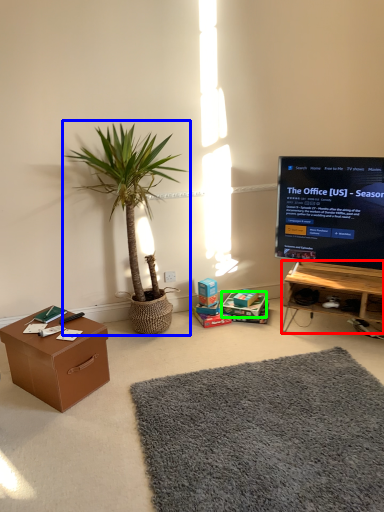
Question: Estimate the real-world distances between objects in this image. Which object is farther from desk (highlighted by a red box), houseplant (highlighted by a blue box) or cardboard box (highlighted by a green box)?

Choices:
 (A) houseplant
 (B) cardboard box

Answer: (A)